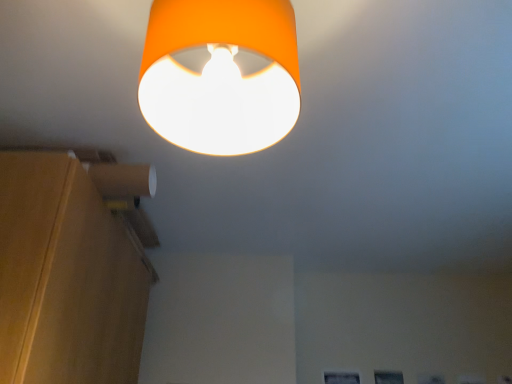
Locate an element on the screen. Image resolution: width=512 pixels, height=384 pixels. orange matte lampshade at upper center is located at coordinates (221, 75).

The image size is (512, 384). Describe the element at coordinates (221, 75) in the screenshot. I see `orange matte lampshade at upper center` at that location.

The width and height of the screenshot is (512, 384). Find the location of `orange matte lampshade at upper center`. orange matte lampshade at upper center is located at coordinates (221, 75).